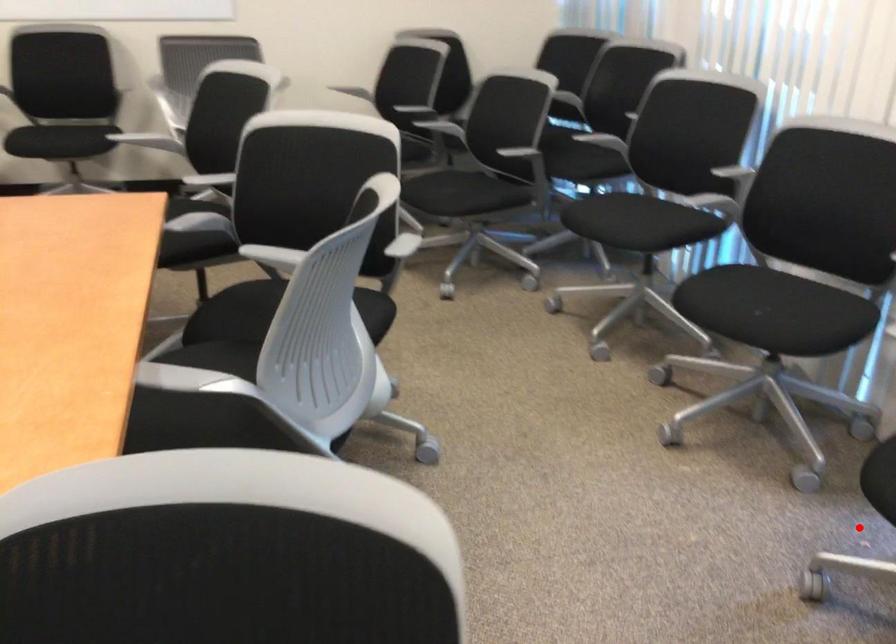
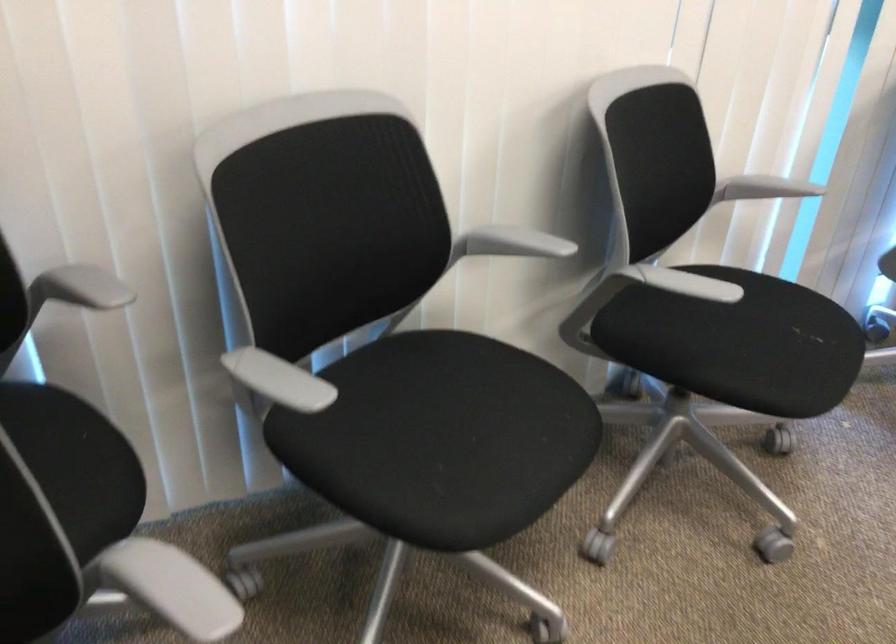
Question: I am providing you with two images of the same scene from different viewpoints. A red point is marked on the first image. Can you still see the location of the red point in image 2?

Choices:
 (A) Yes
 (B) No

Answer: (B)